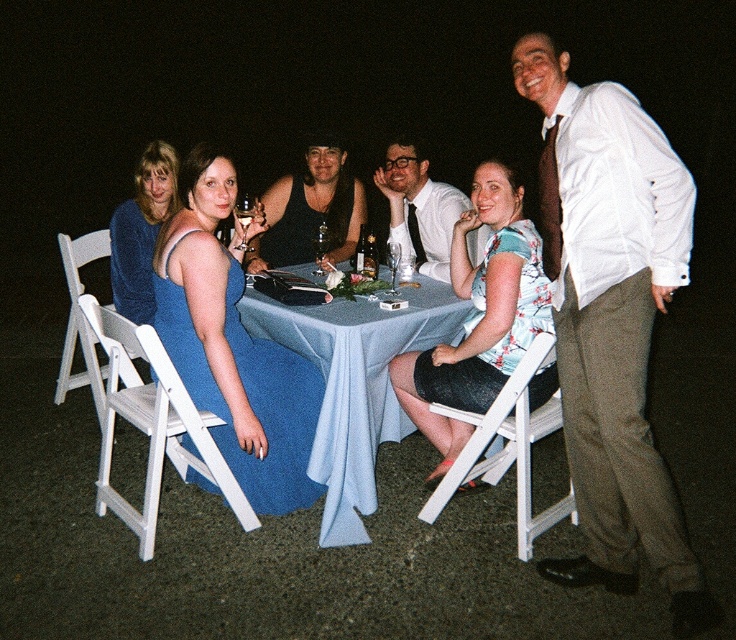
Question: Which point is closer to the camera taking this photo?

Choices:
 (A) (606, 332)
 (B) (135, 200)
 (C) (456, 330)

Answer: (A)

Question: In this image, where is matte blue dress at left located relative to blue fabric table at center?

Choices:
 (A) above
 (B) below

Answer: (A)

Question: Can you confirm if white textured shirt at center is bigger than matte blue dress at left?

Choices:
 (A) no
 (B) yes

Answer: (B)

Question: Among these points, which one is nearest to the camera?

Choices:
 (A) (212, 307)
 (B) (584, 532)
 (C) (503, 196)
 (D) (445, 276)

Answer: (A)

Question: Which point appears farthest from the camera in this image?

Choices:
 (A) (138, 170)
 (B) (503, 186)
 (C) (371, 426)

Answer: (A)

Question: In this image, where is blue fabric table at center located relative to floral fabric dress at center?

Choices:
 (A) above
 (B) below

Answer: (B)